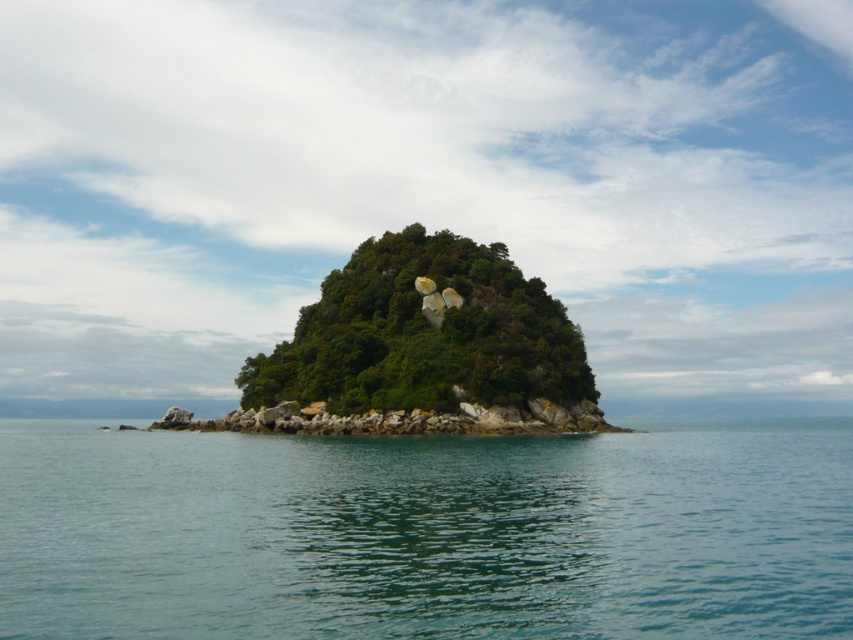
Looking at this image, you are standing on a boat looking at the clear blue water at center and the green leafy island at center. Which object is located lower in the image?

The clear blue water at center is located lower than the green leafy island at center in the image.

You are a boat captain navigating through the clear blue water at center. You want to reach the green leafy island at center. Based on the scene, which direction should you steer your boat to approach the island?

The clear blue water at center is in front of the green leafy island at center, so you should steer your boat towards the direction of the clear blue water at center to approach the island.

You are a drone operator trying to capture aerial footage of the clear blue water at center and the green leafy island at center. Since your drone has a limited flight altitude, you need to know which one is closer to the sky. Which object is lower in height?

The clear blue water at center has a lesser height compared to the green leafy island at center, so the clear blue water at center is lower in height.